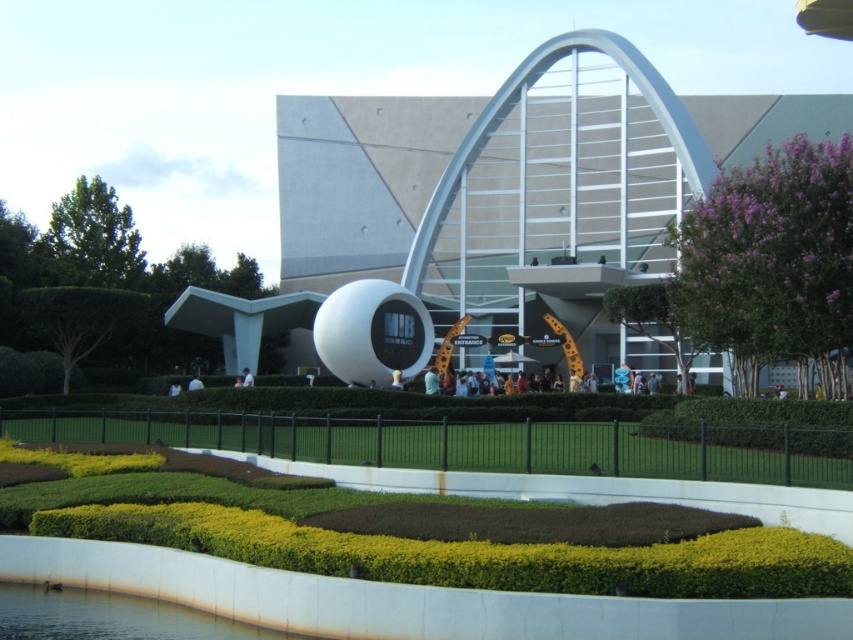
You are standing in front of the futuristic building and want to take a photo of both the white archway entrance and the black MIB sphere. You notice two points marked as point 1 at coordinates point (409, 365) and point 2 at coordinates point (767, 316). Which point should you stand closer to ensure both landmarks are in frame?

You should stand closer to point (409, 365) because it is closer to the camera than point (767, 316), allowing both the white archway entrance and the black MIB sphere to be in frame.

You are a visitor approaching the futuristic building and want to take a photo of both the white smooth sphere at center and the green leafy hedge at upper right. Based on their sizes, which object should you position closer to the camera to ensure both are visible in the frame?

The white smooth sphere at center is larger than the green leafy hedge at upper right. To ensure both are visible in the frame, you should position the green leafy hedge at upper right closer to the camera since it is smaller and needs to be enlarged in the photo to balance with the larger sphere.